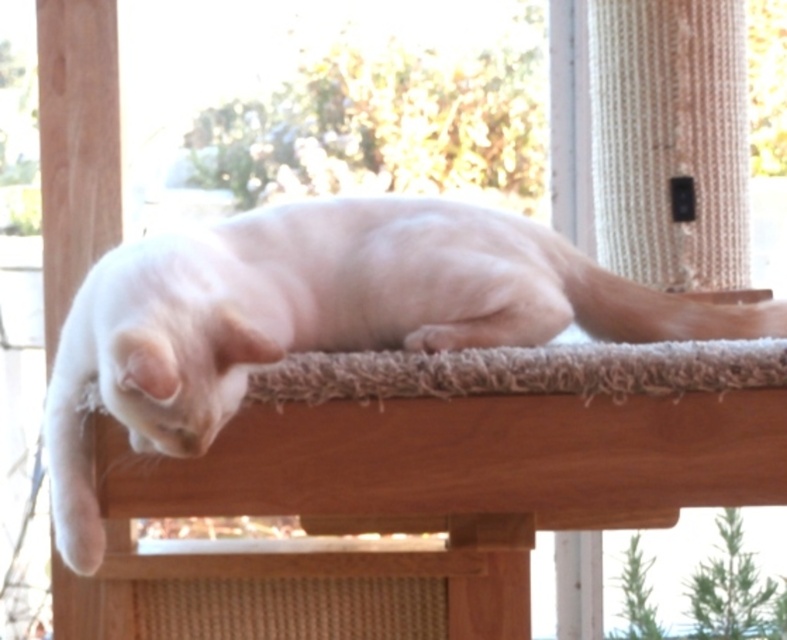
You are a cat owner who wants to place a small toy at point [320,317]. According to the image, what is located there?

At point [320,317] lies white fur cat at center.

You are a cat owner who wants to ensure your cat has enough space to stretch out comfortably on the cat tree. Given the white fur cat at center and the shaggy beige carpet at center, which object allows the cat to stretch more vertically?

The white fur cat at center is much taller than the shaggy beige carpet at center, so the cat can stretch more vertically on the white fur cat at center.

You are a cat owner who wants to place a small toy 0.8 meters away from the white fur cat at center. Can you place it within the platform where the cat is resting?

The white fur cat at center is 1.00 meters apart from the platform, so placing the toy 0.8 meters away from the cat would require placing it on the platform since the distance between the cat and the edge is greater than 0.8 meters.